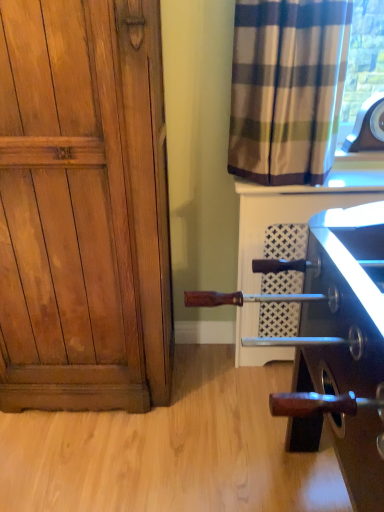
Question: From the image's perspective, would you say plaid fabric curtain at upper right is shown under white textured tile at upper right?

Choices:
 (A) yes
 (B) no

Answer: (B)

Question: Is plaid fabric curtain at upper right behind white textured tile at upper right?

Choices:
 (A) no
 (B) yes

Answer: (A)

Question: Does plaid fabric curtain at upper right have a greater width compared to white textured tile at upper right?

Choices:
 (A) yes
 (B) no

Answer: (B)

Question: Could you tell me if plaid fabric curtain at upper right is turned towards white textured tile at upper right?

Choices:
 (A) yes
 (B) no

Answer: (B)

Question: From the image's perspective, is plaid fabric curtain at upper right located above white textured tile at upper right?

Choices:
 (A) no
 (B) yes

Answer: (B)

Question: Is wooden handle at lower right inside the boundaries of plaid fabric curtain at upper right, or outside?

Choices:
 (A) inside
 (B) outside

Answer: (B)

Question: Is wooden handle at lower right bigger or smaller than plaid fabric curtain at upper right?

Choices:
 (A) big
 (B) small

Answer: (B)

Question: Considering the positions of wooden handle at lower right and plaid fabric curtain at upper right in the image, is wooden handle at lower right taller or shorter than plaid fabric curtain at upper right?

Choices:
 (A) tall
 (B) short

Answer: (B)

Question: Does point (279, 389) appear closer or farther from the camera than point (301, 99)?

Choices:
 (A) closer
 (B) farther

Answer: (B)

Question: Looking at their shapes, would you say white textured tile at upper right is wider or thinner than plaid fabric curtain at upper right?

Choices:
 (A) wide
 (B) thin

Answer: (A)

Question: Is white textured tile at upper right in front of or behind plaid fabric curtain at upper right in the image?

Choices:
 (A) behind
 (B) front

Answer: (A)

Question: Would you say white textured tile at upper right is to the left or to the right of plaid fabric curtain at upper right in the picture?

Choices:
 (A) right
 (B) left

Answer: (A)

Question: Does point (359, 181) appear closer or farther from the camera than point (291, 119)?

Choices:
 (A) farther
 (B) closer

Answer: (A)

Question: Does point (230, 135) appear closer or farther from the camera than point (236, 186)?

Choices:
 (A) farther
 (B) closer

Answer: (A)

Question: Considering their positions, is plaid fabric curtain at upper right located in front of or behind white textured tile at upper right?

Choices:
 (A) front
 (B) behind

Answer: (A)